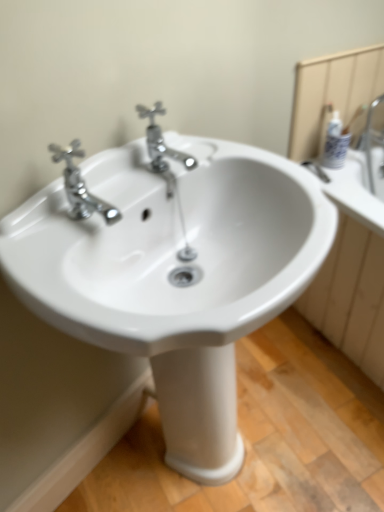
Question: Can you confirm if chrome metallic faucet at upper left, the first tap from the left, is shorter than chrome/metallic faucet at center, the 2th tap positioned from the left?

Choices:
 (A) yes
 (B) no

Answer: (A)

Question: From a real-world perspective, is chrome metallic faucet at upper left, the 2th tap when ordered from right to left, positioned under chrome/metallic faucet at center, the 2th tap positioned from the left, based on gravity?

Choices:
 (A) no
 (B) yes

Answer: (A)

Question: Does chrome metallic faucet at upper left, the 2th tap when ordered from right to left, appear on the right side of chrome/metallic faucet at center, the 2th tap positioned from the left?

Choices:
 (A) yes
 (B) no

Answer: (B)

Question: Is chrome metallic faucet at upper left, the 2th tap when ordered from right to left, positioned behind chrome/metallic faucet at center, the 2th tap positioned from the left?

Choices:
 (A) no
 (B) yes

Answer: (A)

Question: Does chrome metallic faucet at upper left, the 2th tap when ordered from right to left, have a greater height compared to chrome/metallic faucet at center, positioned as the 1th tap in right-to-left order?

Choices:
 (A) no
 (B) yes

Answer: (A)

Question: Is the depth of chrome metallic faucet at upper left, the first tap from the left, less than that of chrome/metallic faucet at center, positioned as the 1th tap in right-to-left order?

Choices:
 (A) yes
 (B) no

Answer: (A)

Question: Can you confirm if white glossy mirror at upper right is shorter than chrome metallic faucet at upper left, the first tap from the left?

Choices:
 (A) no
 (B) yes

Answer: (A)

Question: From a real-world perspective, is white glossy mirror at upper right located beneath chrome metallic faucet at upper left, the 2th tap when ordered from right to left?

Choices:
 (A) no
 (B) yes

Answer: (B)

Question: From the image's perspective, does white glossy mirror at upper right appear higher than chrome metallic faucet at upper left, the 2th tap when ordered from right to left?

Choices:
 (A) no
 (B) yes

Answer: (B)

Question: Is white glossy mirror at upper right positioned beyond the bounds of chrome metallic faucet at upper left, the 2th tap when ordered from right to left?

Choices:
 (A) no
 (B) yes

Answer: (B)

Question: From the image's perspective, is white glossy mirror at upper right beneath chrome metallic faucet at upper left, the first tap from the left?

Choices:
 (A) yes
 (B) no

Answer: (B)

Question: Can you confirm if white glossy mirror at upper right is wider than chrome metallic faucet at upper left, the first tap from the left?

Choices:
 (A) yes
 (B) no

Answer: (B)

Question: Is chrome/metallic faucet at center, positioned as the 1th tap in right-to-left order, positioned far away from chrome metallic faucet at upper left, the 2th tap when ordered from right to left?

Choices:
 (A) no
 (B) yes

Answer: (A)